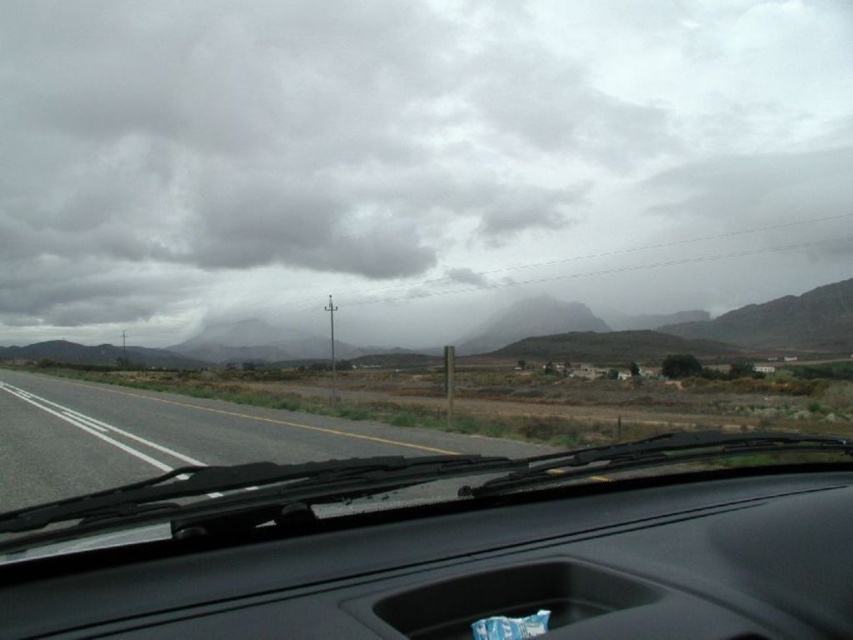
Is gray cloudy sky at upper center above asphalt road at left?

Correct, gray cloudy sky at upper center is located above asphalt road at left.

Who is positioned more to the right, gray cloudy sky at upper center or asphalt road at left?

Positioned to the right is gray cloudy sky at upper center.

Which is in front, point (149, 92) or point (160, 442)?

Point (160, 442)

Identify the location of gray cloudy sky at upper center. The width and height of the screenshot is (853, 640). (413, 160).

Does gray cloudy sky at upper center appear on the left side of black matte dashboard at center?

Correct, you'll find gray cloudy sky at upper center to the left of black matte dashboard at center.

Which of these two, gray cloudy sky at upper center or black matte dashboard at center, stands taller?

Standing taller between the two is gray cloudy sky at upper center.

The image size is (853, 640). What do you see at coordinates (413, 160) in the screenshot?
I see `gray cloudy sky at upper center` at bounding box center [413, 160].

You are a GUI agent. You are given a task and a screenshot of the screen. Output one action in this format:
    pyautogui.click(x=<x>, y=<y>)
    Task: Click on the gray cloudy sky at upper center
    
    Given the screenshot: What is the action you would take?
    pyautogui.click(x=413, y=160)

Is the position of black matte dashboard at center less distant than that of asphalt road at left?

That is True.

Which is below, black matte dashboard at center or asphalt road at left?

asphalt road at left is lower down.

Where is `black matte dashboard at center`? black matte dashboard at center is located at coordinates (448, 548).

Where is `black matte dashboard at center`? The height and width of the screenshot is (640, 853). black matte dashboard at center is located at coordinates (448, 548).